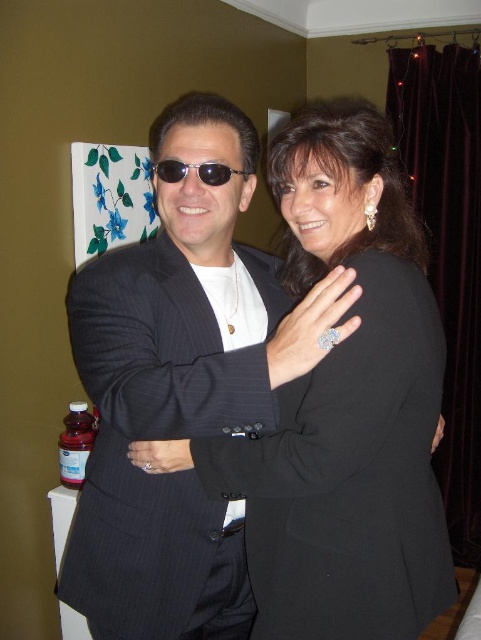
Does point (157, 188) come in front of point (197, 426)?

No, it is behind (197, 426).

Is point (152, 404) behind point (244, 404)?

That is True.

At what (x,y) coordinates should I click in order to perform the action: click on black pinstripe suit at center. Please return your answer as a coordinate pair (x, y). Image resolution: width=481 pixels, height=640 pixels. Looking at the image, I should click on click(172, 396).

Is point (85, 332) closer to viewer compared to point (266, 538)?

Yes, it is.

Image resolution: width=481 pixels, height=640 pixels. What do you see at coordinates (172, 396) in the screenshot?
I see `black pinstripe suit at center` at bounding box center [172, 396].

Find the location of a particular element. black pinstripe suit at center is located at coordinates (172, 396).

Is point (268, 552) closer to camera compared to point (157, 177)?

Yes.

Identify the location of black satin dress at center. (349, 476).